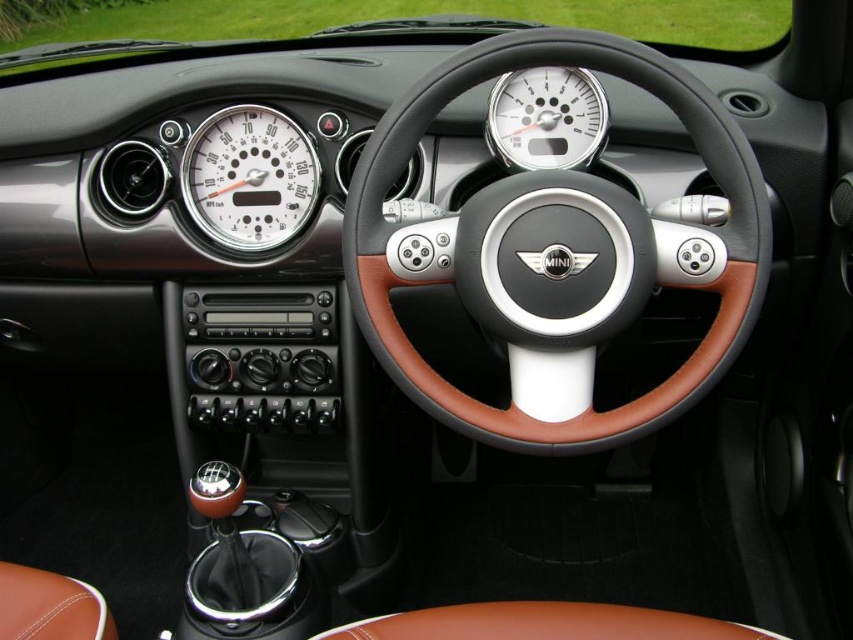
Measure the distance between point (383, 268) and camera.

A distance of 3.79 feet exists between point (383, 268) and camera.

Between brown leather steering wheel at center and white metallic speedometer at center, which one has less height?

white metallic speedometer at center

Image resolution: width=853 pixels, height=640 pixels. What do you see at coordinates (556, 253) in the screenshot?
I see `brown leather steering wheel at center` at bounding box center [556, 253].

The width and height of the screenshot is (853, 640). Identify the location of brown leather steering wheel at center. (556, 253).

Who is taller, brown leather steering wheel at center or white glossy speedometer at center?

Standing taller between the two is brown leather steering wheel at center.

Between brown leather steering wheel at center and white glossy speedometer at center, which one appears on the right side from the viewer's perspective?

brown leather steering wheel at center is more to the right.

The image size is (853, 640). What are the coordinates of `brown leather steering wheel at center` in the screenshot? It's located at (556, 253).

This screenshot has width=853, height=640. I want to click on brown leather steering wheel at center, so click(x=556, y=253).

Between white glossy speedometer at center and white metallic speedometer at center, which one appears on the left side from the viewer's perspective?

white glossy speedometer at center is more to the left.

Can you confirm if white glossy speedometer at center is positioned to the right of white metallic speedometer at center?

In fact, white glossy speedometer at center is to the left of white metallic speedometer at center.

Where is `white glossy speedometer at center`? The image size is (853, 640). white glossy speedometer at center is located at coordinates click(248, 177).